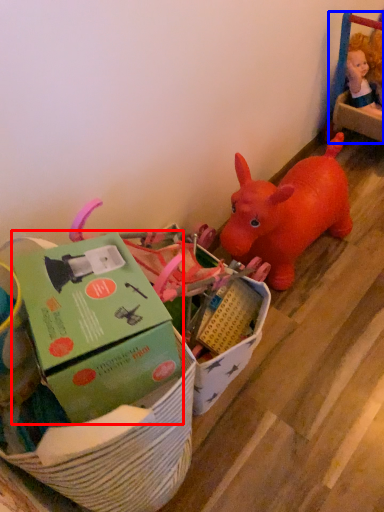
Question: Which object appears farthest to the camera in this image, box (highlighted by a red box) or toy (highlighted by a blue box)?

Choices:
 (A) box
 (B) toy

Answer: (B)